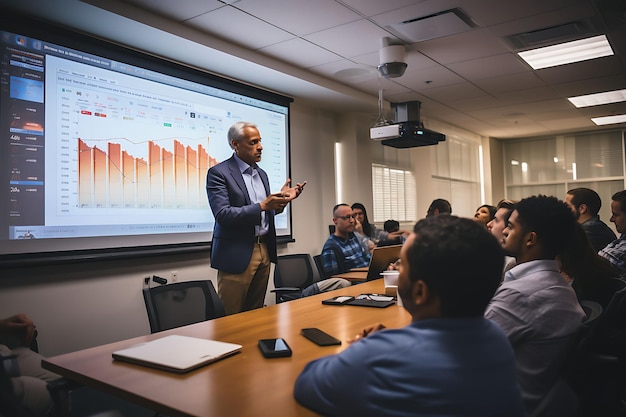
I want to click on business office, so click(83, 153), click(74, 301), click(374, 197), click(326, 185), click(513, 160), click(315, 302), click(171, 412).